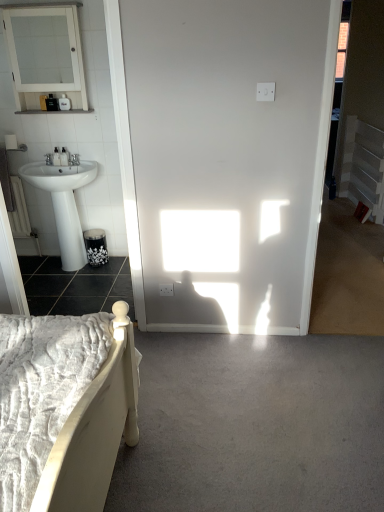
Describe the element at coordinates (363, 166) in the screenshot. I see `white plastic balustrade at right` at that location.

Measure the distance between white plastic balustrade at right and camera.

The depth of white plastic balustrade at right is 4.13 meters.

How much space does matte black soap dispenser at left, which appears as the third toiletry when viewed from the top, occupy horizontally?

matte black soap dispenser at left, which appears as the third toiletry when viewed from the top, is 3.19 inches wide.

At what (x,y) coordinates should I click in order to perform the action: click on matte black soap dispenser at left, positioned as the 1th toiletry in bottom-to-top order. Please return your answer as a coordinate pair (x, y). The image size is (384, 512). Looking at the image, I should click on (64, 157).

Find the location of a particular element. The width and height of the screenshot is (384, 512). white glossy pedestal sink at left is located at coordinates (64, 204).

This screenshot has width=384, height=512. I want to click on white plastic balustrade at right, so click(x=363, y=166).

Considering the relative sizes of matte black soap dispenser at left, which appears as the third toiletry when viewed from the top, and white glossy medicine cabinet at upper left in the image provided, is matte black soap dispenser at left, which appears as the third toiletry when viewed from the top, smaller than white glossy medicine cabinet at upper left?

Yes.

Which is nearer, (66, 152) or (31, 94)?

Point (66, 152) appears to be farther away from the viewer than point (31, 94).

From the image's perspective, does matte black soap dispenser at left, which appears as the third toiletry when viewed from the top, appear higher than white glossy medicine cabinet at upper left?

Actually, matte black soap dispenser at left, which appears as the third toiletry when viewed from the top, appears below white glossy medicine cabinet at upper left in the image.

From a real-world perspective, who is located higher, matte black soap dispenser at left, positioned as the 1th toiletry in bottom-to-top order, or white glossy medicine cabinet at upper left?

white glossy medicine cabinet at upper left, from a real-world perspective.

Considering the positions of objects white glossy medicine cabinet at upper left and white plastic balustrade at right in the image provided, who is more to the right, white glossy medicine cabinet at upper left or white plastic balustrade at right?

From the viewer's perspective, white plastic balustrade at right appears more on the right side.

Considering the sizes of objects white glossy medicine cabinet at upper left and white plastic balustrade at right in the image provided, who is wider, white glossy medicine cabinet at upper left or white plastic balustrade at right?

white glossy medicine cabinet at upper left.

Is white glossy medicine cabinet at upper left smaller than white plastic balustrade at right?

Yes, white glossy medicine cabinet at upper left is smaller than white plastic balustrade at right.

Is white glossy medicine cabinet at upper left located outside white plastic balustrade at right?

That's correct, white glossy medicine cabinet at upper left is outside of white plastic balustrade at right.

Locate an element on the screen. The image size is (384, 512). balustrade above the white glossy pedestal sink at left (from a real-world perspective) is located at coordinates (363, 166).

Does point (76, 213) appear closer or farther from the camera than point (341, 167)?

Point (76, 213) appears to be closer to the viewer than point (341, 167).

From the image's perspective, which is above, white glossy pedestal sink at left or white plastic balustrade at right?

white plastic balustrade at right.

Is white glossy pedestal sink at left positioned beyond the bounds of white plastic balustrade at right?

Yes, white glossy pedestal sink at left is outside of white plastic balustrade at right.

Is gray carpet at lower center, which ranks as the second concrete in back-to-front order, oriented away from matte black soap dispenser at upper left, which appears as the third toiletry when ordered from the bottom?

No.

Would you say gray carpet at lower center, marked as the 1th concrete in a front-to-back arrangement, contains matte black soap dispenser at upper left, which appears as the third toiletry when ordered from the bottom?

Actually, matte black soap dispenser at upper left, which appears as the third toiletry when ordered from the bottom, is outside gray carpet at lower center, marked as the 1th concrete in a front-to-back arrangement.

From the image's perspective, is gray carpet at lower center, marked as the 1th concrete in a front-to-back arrangement, beneath matte black soap dispenser at upper left, which appears as the third toiletry when ordered from the bottom?

Yes, from the image's perspective, gray carpet at lower center, marked as the 1th concrete in a front-to-back arrangement, is beneath matte black soap dispenser at upper left, which appears as the third toiletry when ordered from the bottom.

Is white glossy pedestal sink at left surrounded by white plastic balustrade at right?

No, white glossy pedestal sink at left is located outside of white plastic balustrade at right.

Is white plastic balustrade at right in contact with white glossy pedestal sink at left?

No, white plastic balustrade at right is not beside white glossy pedestal sink at left.

Is point (373, 161) positioned before point (77, 257)?

No.

How distant is white plastic balustrade at right from white glossy pedestal sink at left?

white plastic balustrade at right is 9.49 feet from white glossy pedestal sink at left.

Do you think black glossy concrete at lower left, which is counted as the 2th concrete, starting from the front, is within matte black soap dispenser at left, positioned as the 1th toiletry in bottom-to-top order, or outside of it?

The correct answer is: outside.

You are a GUI agent. You are given a task and a screenshot of the screen. Output one action in this format:
    pyautogui.click(x=<x>, y=<y>)
    Task: Click on the 1st toiletry counting from the left side of the black glossy concrete at lower left, acting as the second concrete starting from the right
    
    Given the screenshot: What is the action you would take?
    pyautogui.click(x=64, y=157)

Is black glossy concrete at lower left, positioned as the 1th concrete in back-to-front order, at the left side of matte black soap dispenser at left, which appears as the third toiletry when viewed from the top?

Incorrect, black glossy concrete at lower left, positioned as the 1th concrete in back-to-front order, is not on the left side of matte black soap dispenser at left, which appears as the third toiletry when viewed from the top.

Considering the sizes of objects white glossy medicine cabinet at upper left and matte black soap dispenser at upper left, which appears as the third toiletry when ordered from the bottom, in the image provided, who is thinner, white glossy medicine cabinet at upper left or matte black soap dispenser at upper left, which appears as the third toiletry when ordered from the bottom,?

Thinner between the two is matte black soap dispenser at upper left, which appears as the third toiletry when ordered from the bottom.

Is matte black soap dispenser at upper left, which is the 1th toiletry in top-to-bottom order, a part of white glossy medicine cabinet at upper left?

Yes, matte black soap dispenser at upper left, which is the 1th toiletry in top-to-bottom order, is a part of white glossy medicine cabinet at upper left.

Which of these two, white glossy medicine cabinet at upper left or matte black soap dispenser at upper left, which appears as the third toiletry when ordered from the bottom, is smaller?

matte black soap dispenser at upper left, which appears as the third toiletry when ordered from the bottom, is smaller.

From the image's perspective, which is below, white glossy medicine cabinet at upper left or matte black soap dispenser at upper left, which appears as the third toiletry when ordered from the bottom?

matte black soap dispenser at upper left, which appears as the third toiletry when ordered from the bottom.

Where is `medicine cabinet on the left of matte black soap dispenser at left, which appears as the third toiletry when viewed from the top`? The height and width of the screenshot is (512, 384). medicine cabinet on the left of matte black soap dispenser at left, which appears as the third toiletry when viewed from the top is located at coordinates (45, 51).

Locate an element on the screen. This screenshot has height=512, width=384. balustrade that appears below the white glossy medicine cabinet at upper left (from the image's perspective) is located at coordinates (363, 166).

Considering their positions, is white plastic balustrade at right positioned further to gray carpet at lower center, the 1th concrete when ordered from right to left, than matte black soap dispenser at upper left, which is the 1th toiletry in top-to-bottom order?

Among the two, white plastic balustrade at right is located further to gray carpet at lower center, the 1th concrete when ordered from right to left.

From the image, which object appears to be farther from white plastic balustrade at right, gray carpet at lower center, arranged as the second concrete when viewed from the top, or matte black soap dispenser at upper left, which appears as the third toiletry when ordered from the bottom?

matte black soap dispenser at upper left, which appears as the third toiletry when ordered from the bottom, lies further to white plastic balustrade at right than the other object.

Based on their spatial positions, is gray carpet at lower center, marked as the 1th concrete in a front-to-back arrangement, or white plastic balustrade at right further from white glossy pedestal sink at left?

The object further to white glossy pedestal sink at left is white plastic balustrade at right.

Looking at the image, which one is located closer to matte black soap dispenser at left, which ranks as the second toiletry in top-to-bottom order, black glossy concrete at lower left, which is counted as the 2th concrete, starting from the front, or matte black soap dispenser at upper left, which appears as the third toiletry when ordered from the bottom?

matte black soap dispenser at upper left, which appears as the third toiletry when ordered from the bottom, is positioned closer to the anchor matte black soap dispenser at left, which ranks as the second toiletry in top-to-bottom order.

Which object lies nearer to the anchor point white plastic balustrade at right, matte black soap dispenser at upper left, which appears as the third toiletry when ordered from the bottom, or white glossy medicine cabinet at upper left?

Among the two, matte black soap dispenser at upper left, which appears as the third toiletry when ordered from the bottom, is located nearer to white plastic balustrade at right.

Based on their spatial positions, is matte black soap dispenser at left, which appears as the third toiletry when viewed from the top, or matte black soap dispenser at left, which ranks as the second toiletry in top-to-bottom order, further from white glossy pedestal sink at left?

matte black soap dispenser at left, which appears as the third toiletry when viewed from the top.

Which object lies further to the anchor point matte black soap dispenser at upper left, which is the 1th toiletry in top-to-bottom order, matte black soap dispenser at left, positioned as the 1th toiletry in bottom-to-top order, or gray carpet at lower center, which ranks as the second concrete in back-to-front order?

Based on the image, gray carpet at lower center, which ranks as the second concrete in back-to-front order, appears to be further to matte black soap dispenser at upper left, which is the 1th toiletry in top-to-bottom order.

Looking at the image, which one is located further to white glossy medicine cabinet at upper left, white glossy pedestal sink at left or matte black soap dispenser at left, which ranks as the second toiletry in top-to-bottom order?

matte black soap dispenser at left, which ranks as the second toiletry in top-to-bottom order, lies further to white glossy medicine cabinet at upper left than the other object.

Where is `sink located between matte black soap dispenser at left, which appears as the 2th toiletry when ordered from the bottom, and white plastic balustrade at right in the left-right direction`? The width and height of the screenshot is (384, 512). sink located between matte black soap dispenser at left, which appears as the 2th toiletry when ordered from the bottom, and white plastic balustrade at right in the left-right direction is located at coordinates (64, 204).

Where is `sink between matte black soap dispenser at upper left, which is the 1th toiletry in top-to-bottom order, and black glossy concrete at lower left, which appears as the 1th concrete when viewed from the top, in the vertical direction`? The width and height of the screenshot is (384, 512). sink between matte black soap dispenser at upper left, which is the 1th toiletry in top-to-bottom order, and black glossy concrete at lower left, which appears as the 1th concrete when viewed from the top, in the vertical direction is located at coordinates 64,204.

Locate an element on the screen. The height and width of the screenshot is (512, 384). concrete between gray carpet at lower center, which ranks as the second concrete in back-to-front order, and white glossy pedestal sink at left, along the z-axis is located at coordinates (75, 286).

Image resolution: width=384 pixels, height=512 pixels. Identify the location of concrete between white glossy medicine cabinet at upper left and gray carpet at lower center, marked as the 1th concrete in a front-to-back arrangement, vertically. (75, 286).